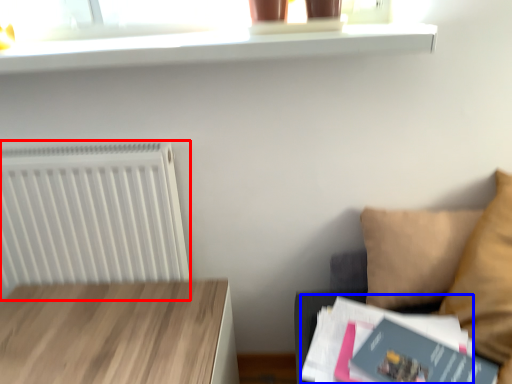
Question: Which point is closer to the camera, radiator (highlighted by a red box) or paperback book (highlighted by a blue box)?

Choices:
 (A) radiator
 (B) paperback book

Answer: (B)